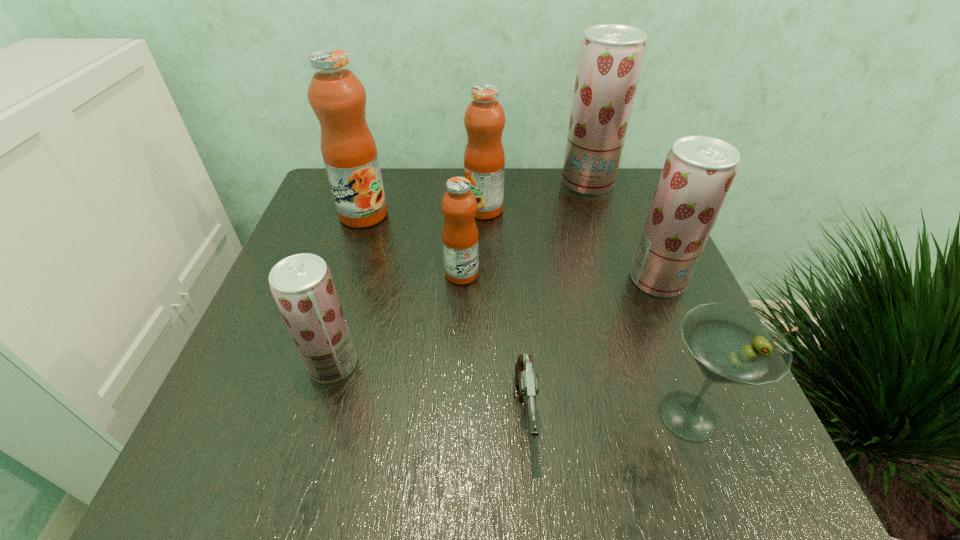
In the image, there is a desktop. Where is `vacant space at the near left corner`? The image size is (960, 540). vacant space at the near left corner is located at coordinates (238, 494).

Where is `free space at the near right corner of the desktop`? free space at the near right corner of the desktop is located at coordinates (779, 484).

Where is `vacant region between the fifth object from left to right and the second biggest orange fruit juice`? This screenshot has height=540, width=960. vacant region between the fifth object from left to right and the second biggest orange fruit juice is located at coordinates (505, 311).

Where is `free area in between the second nearest strawberry fruit juice and the second smallest orange fruit juice`? free area in between the second nearest strawberry fruit juice and the second smallest orange fruit juice is located at coordinates (x=570, y=245).

Find the location of `empty space between the martini and the second nearest strawberry fruit juice`. empty space between the martini and the second nearest strawberry fruit juice is located at coordinates pyautogui.click(x=673, y=348).

The image size is (960, 540). In order to click on free spot between the smallest strawberry fruit juice and the martini in this screenshot , I will do `click(511, 390)`.

This screenshot has height=540, width=960. I want to click on empty space that is in between the second biggest orange fruit juice and the martini, so tap(587, 313).

Locate an element on the screen. Image resolution: width=960 pixels, height=540 pixels. blank region between the nearest fruit juice and the second nearest strawberry fruit juice is located at coordinates (495, 322).

Where is `vacant area that lies between the pistol and the martini`? vacant area that lies between the pistol and the martini is located at coordinates (607, 414).

Find the location of a particular element. free space between the martini and the biggest orange fruit juice is located at coordinates (526, 315).